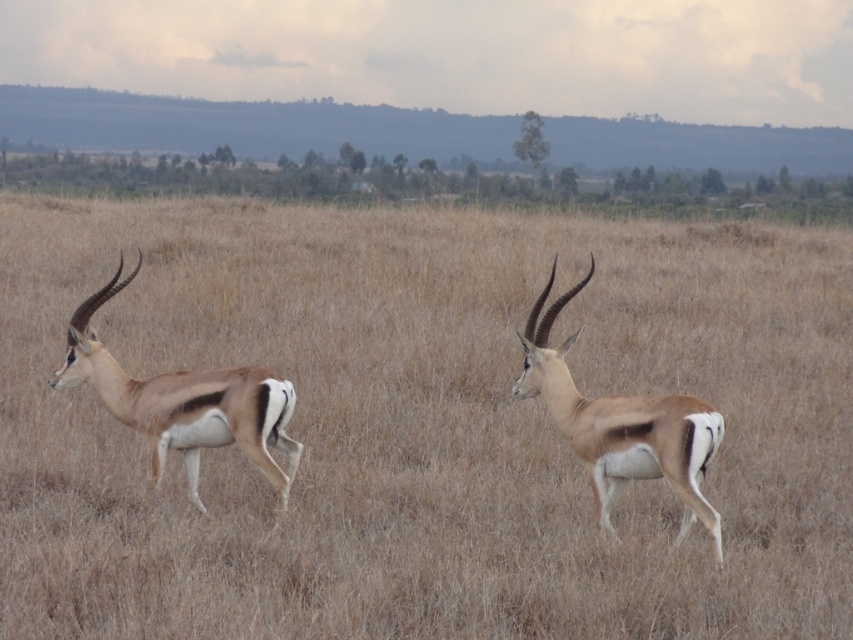
Question: Can you confirm if brown smooth antelope at left is positioned above brown matte deer at center?

Choices:
 (A) yes
 (B) no

Answer: (A)

Question: Can you confirm if brown dry grass at center is positioned to the right of brown matte deer at center?

Choices:
 (A) no
 (B) yes

Answer: (A)

Question: Which object is the closest to the brown matte deer at center?

Choices:
 (A) brown smooth antelope at left
 (B) brown dry grass at center

Answer: (A)

Question: Considering the real-world distances, which object is closest to the brown matte deer at center?

Choices:
 (A) brown dry grass at center
 (B) brown smooth antelope at left

Answer: (B)

Question: Considering the real-world distances, which object is farthest from the brown dry grass at center?

Choices:
 (A) brown matte deer at center
 (B) brown smooth antelope at left

Answer: (A)

Question: Can you confirm if brown smooth antelope at left is positioned below brown matte deer at center?

Choices:
 (A) yes
 (B) no

Answer: (B)